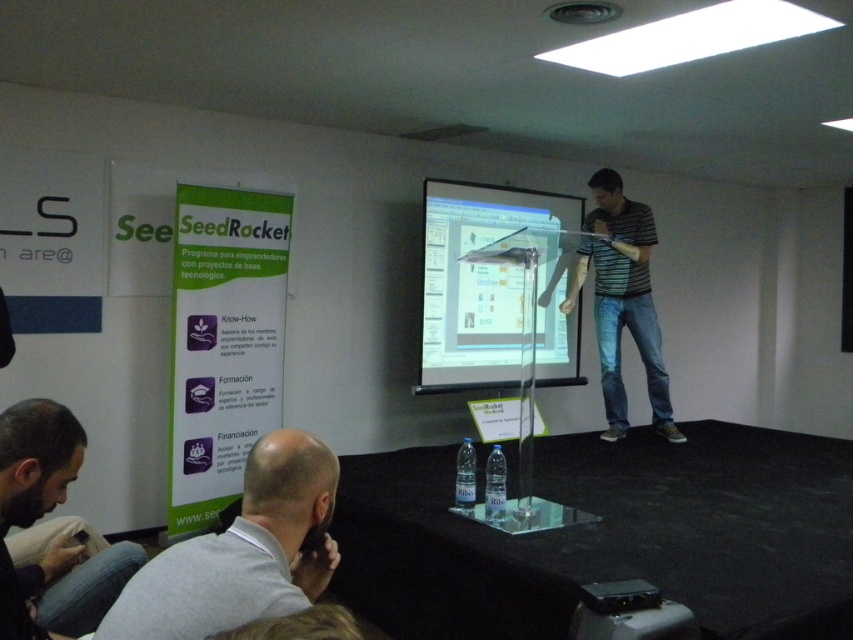
Question: Observing the image, what is the correct spatial positioning of gray cotton shirt at lower left in reference to transparent glass projection screen at center?

Choices:
 (A) above
 (B) below

Answer: (B)

Question: Does transparent glass projection screen at center appear on the right side of striped cotton shirt at center?

Choices:
 (A) yes
 (B) no

Answer: (B)

Question: Among these objects, which one is farthest from the camera?

Choices:
 (A) gray cotton shirt at lower left
 (B) transparent glass projection screen at center
 (C) dark brown leather jacket at lower left

Answer: (B)

Question: Which object is farther from the camera taking this photo?

Choices:
 (A) gray cotton shirt at lower left
 (B) transparent glass projection screen at center
 (C) dark brown leather jacket at lower left
 (D) striped cotton shirt at center

Answer: (B)

Question: Which of these objects is positioned closest to the transparent glass projection screen at center?

Choices:
 (A) gray cotton shirt at lower left
 (B) dark brown leather jacket at lower left

Answer: (B)

Question: Can you confirm if transparent glass projection screen at center is positioned to the right of striped cotton shirt at center?

Choices:
 (A) no
 (B) yes

Answer: (A)